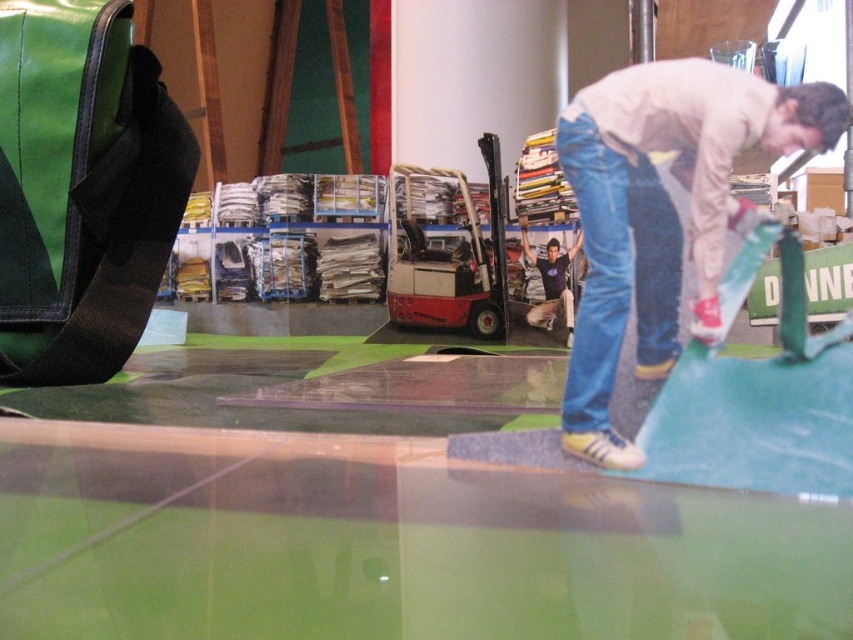
Can you confirm if green fabric bag at upper left is positioned above dark blue t-shirt at center?

Indeed, green fabric bag at upper left is positioned over dark blue t-shirt at center.

Is green fabric bag at upper left to the right of dark blue t-shirt at center from the viewer's perspective?

Incorrect, green fabric bag at upper left is not on the right side of dark blue t-shirt at center.

The height and width of the screenshot is (640, 853). Describe the element at coordinates (82, 188) in the screenshot. I see `green fabric bag at upper left` at that location.

The height and width of the screenshot is (640, 853). Identify the location of green fabric bag at upper left. (82, 188).

Is point (79, 248) positioned in front of point (573, 420)?

No, (79, 248) is further to viewer.

Consider the image. Who is lower down, green fabric bag at upper left or light blue smooth skateboard at right?

Positioned lower is light blue smooth skateboard at right.

Does point (187, 164) come behind point (793, 134)?

Yes, point (187, 164) is farther from viewer.

The width and height of the screenshot is (853, 640). Find the location of `green fabric bag at upper left`. green fabric bag at upper left is located at coordinates (82, 188).

Is point (703, 147) closer to camera compared to point (555, 307)?

That is True.

Between light blue smooth skateboard at right and dark blue t-shirt at center, which one is positioned lower?

Positioned lower is light blue smooth skateboard at right.

Find the location of a particular element. The image size is (853, 640). light blue smooth skateboard at right is located at coordinates tap(663, 214).